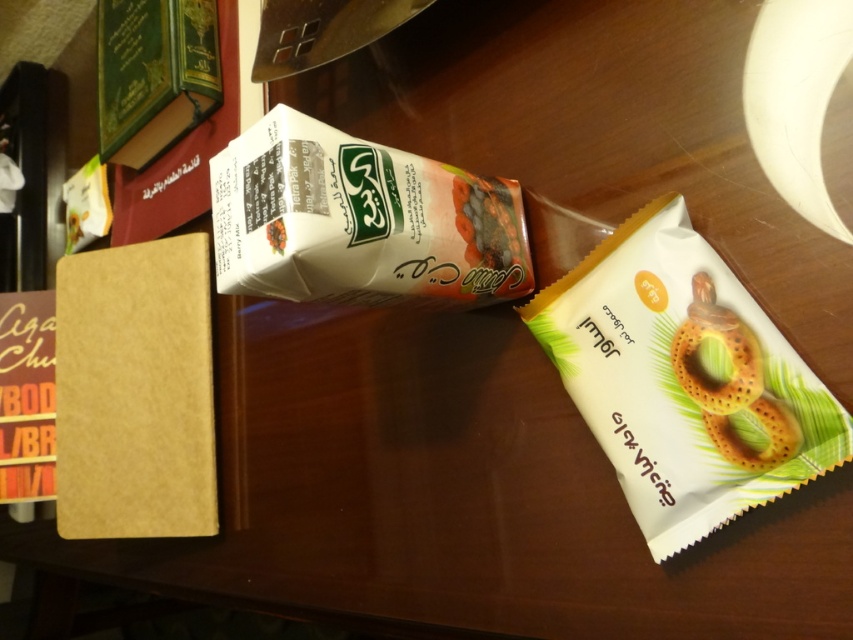
Image resolution: width=853 pixels, height=640 pixels. I want to click on matte white bagel at right, so click(683, 380).

Does matte white bagel at right appear on the left side of white matte juice carton at center?

In fact, matte white bagel at right is to the right of white matte juice carton at center.

Between point (726, 435) and point (271, 250), which one is positioned in front?

Point (271, 250)

I want to click on matte white bagel at right, so click(x=683, y=380).